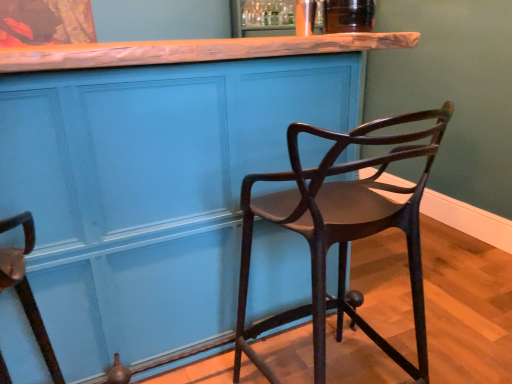
What do you see at coordinates (341, 231) in the screenshot?
I see `dark brown wood chair at center` at bounding box center [341, 231].

What is the approximate width of dark brown wood chair at center?

55.55 centimeters.

Find the location of a particular element. dark brown wood chair at center is located at coordinates (341, 231).

Identify the location of dark brown wood chair at center. This screenshot has width=512, height=384. (341, 231).